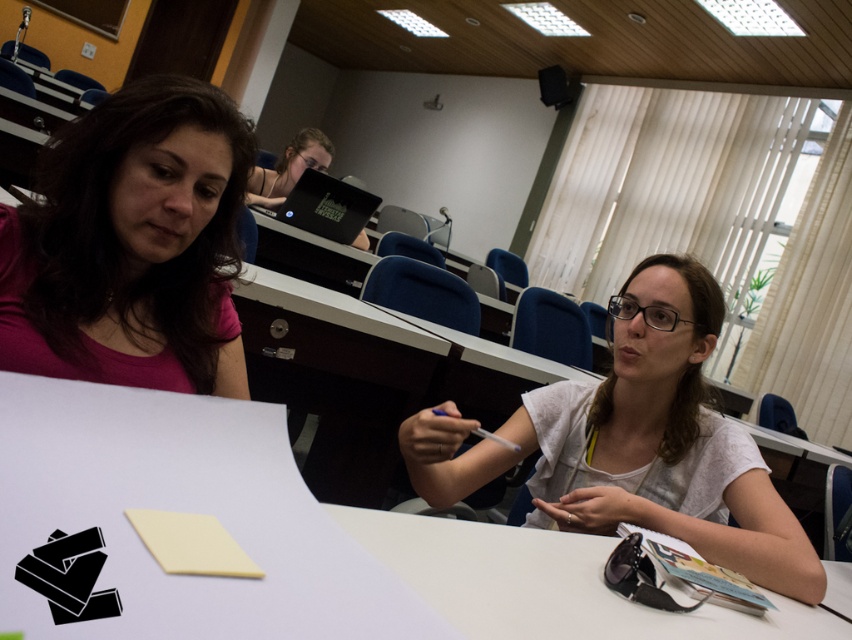
Does pink matte shirt at upper left appear under matte black laptop at upper center?

Yes, pink matte shirt at upper left is below matte black laptop at upper center.

Which is above, pink matte shirt at upper left or matte black laptop at upper center?

matte black laptop at upper center

I want to click on pink matte shirt at upper left, so click(131, 244).

Between white matte shirt at center and black matte laptop at upper center, which one is positioned lower?

Positioned lower is white matte shirt at center.

This screenshot has height=640, width=852. Find the location of `white matte shirt at center`. white matte shirt at center is located at coordinates (635, 444).

Who is more distant from viewer, (x=718, y=442) or (x=314, y=227)?

Positioned behind is point (x=314, y=227).

This screenshot has width=852, height=640. In order to click on white matte shirt at center in this screenshot , I will do `click(635, 444)`.

This screenshot has width=852, height=640. What do you see at coordinates (131, 244) in the screenshot?
I see `pink matte shirt at upper left` at bounding box center [131, 244].

Can you confirm if pink matte shirt at upper left is smaller than black matte laptop at upper center?

Correct, pink matte shirt at upper left occupies less space than black matte laptop at upper center.

Does point (153, 321) lie in front of point (320, 225)?

That is True.

Find the location of `pink matte shirt at upper left`. pink matte shirt at upper left is located at coordinates (131, 244).